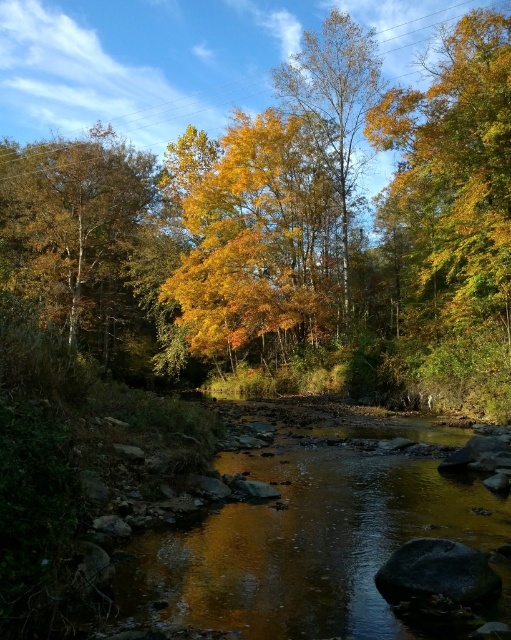
Does point (132, 540) come farther from viewer compared to point (266, 273)?

No, it is in front of (266, 273).

Which is in front, point (394, 540) or point (246, 154)?

Point (394, 540) is more forward.

Locate an element on the screen. This screenshot has width=511, height=640. shiny brown water at center is located at coordinates pos(310,540).

Does shiny brown water at center appear on the left side of golden textured leaves at left?

Incorrect, shiny brown water at center is not on the left side of golden textured leaves at left.

Is shiny brown water at center taller than golden textured leaves at left?

Incorrect, shiny brown water at center's height is not larger of golden textured leaves at left's.

Measure the distance between point (135, 541) and camera.

Point (135, 541) is 8.46 meters from camera.

Image resolution: width=511 pixels, height=640 pixels. I want to click on shiny brown water at center, so (x=310, y=540).

Can you confirm if shiny brown water at center is positioned to the right of yellow/golden leaves at center?

In fact, shiny brown water at center is to the left of yellow/golden leaves at center.

Who is taller, shiny brown water at center or yellow/golden leaves at center?

yellow/golden leaves at center

Where is `shiny brown water at center`? Image resolution: width=511 pixels, height=640 pixels. shiny brown water at center is located at coordinates (310, 540).

Locate an element on the screen. shiny brown water at center is located at coordinates (310, 540).